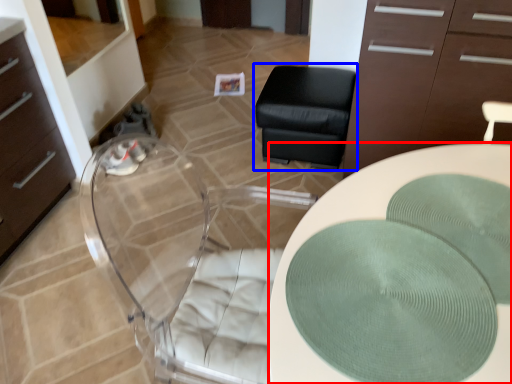
Question: Among these objects, which one is nearest to the camera, desk (highlighted by a red box) or furniture (highlighted by a blue box)?

Choices:
 (A) desk
 (B) furniture

Answer: (A)